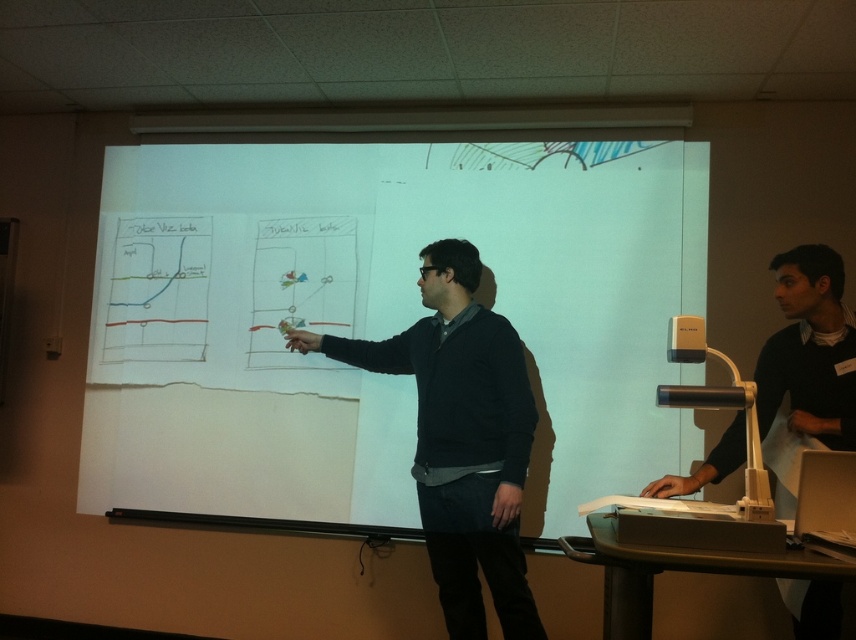
You are standing in the classroom and want to present using the white matte projection screen at center. Where should you position yourself to ensure the screen is clearly visible to the audience?

You should position yourself to the side or behind the white matte projection screen at center to avoid blocking the audience view.

From the picture: You are a student sitting in the classroom. You notice the white matte projection screen at center and the dark blue sweater at center. How far apart are these two objects?

The white matte projection screen at center is 49.18 centimeters from the dark blue sweater at center.